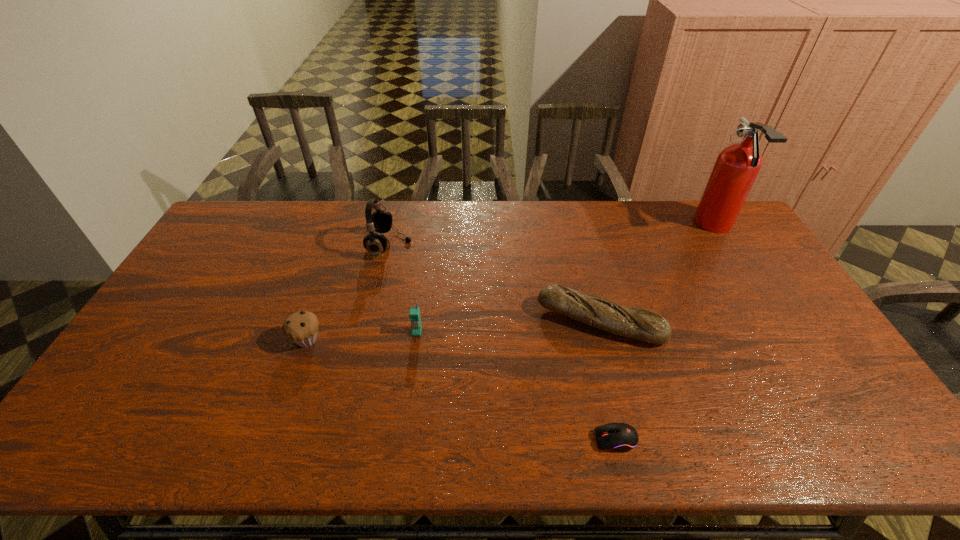
Identify the location of free space that satisfies the following two spatial constraints: 1. with the microphone on the side of the headset; 2. on the back side of the baguet. (372, 322).

You are a GUI agent. You are given a task and a screenshot of the screen. Output one action in this format:
    pyautogui.click(x=<x>, y=<y>)
    Task: Click on the free spot that satisfies the following two spatial constraints: 1. with the microphone on the side of the baguet; 2. on the left side of the fifth object from right to left
    This screenshot has height=540, width=960.
    Given the screenshot: What is the action you would take?
    pyautogui.click(x=372, y=322)

Where is `free space that satisfies the following two spatial constraints: 1. with the microphone on the side of the headset; 2. on the right side of the computer mouse`? This screenshot has height=540, width=960. free space that satisfies the following two spatial constraints: 1. with the microphone on the side of the headset; 2. on the right side of the computer mouse is located at coordinates (346, 439).

This screenshot has width=960, height=540. I want to click on vacant region that satisfies the following two spatial constraints: 1. with the microphone on the side of the second object from left to right; 2. on the left side of the baguet, so click(x=372, y=322).

Locate an element on the screen. The height and width of the screenshot is (540, 960). vacant space that satisfies the following two spatial constraints: 1. on the keypad of the nearest object; 2. on the left side of the third object from left to right is located at coordinates (403, 439).